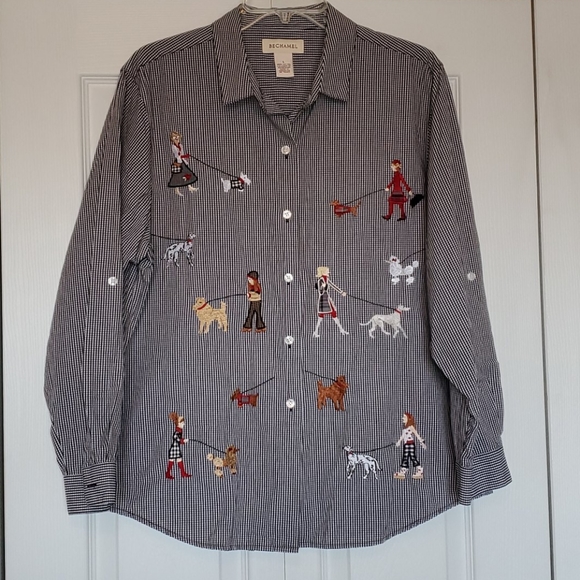
Find the location of a particular element. The image size is (580, 580). artwork lowest right is located at coordinates (414, 453).